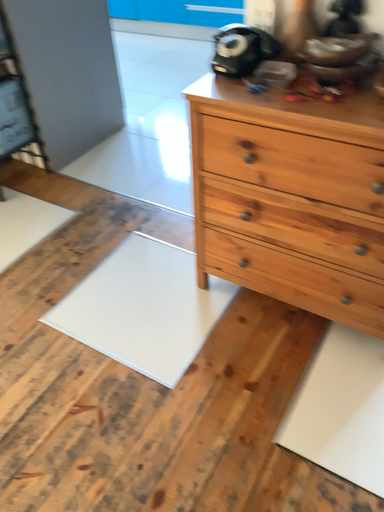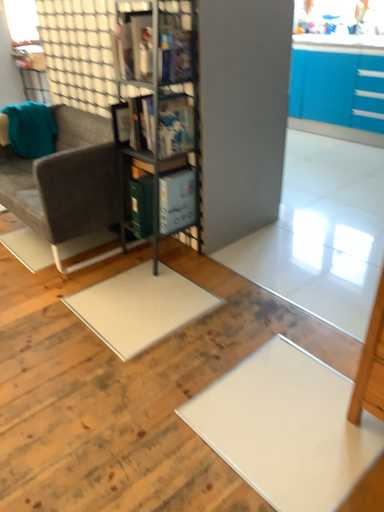
Question: Which way did the camera rotate in the video?

Choices:
 (A) rotated upward
 (B) rotated downward

Answer: (A)